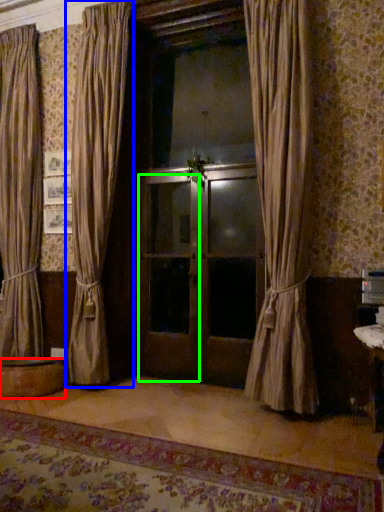
Question: Which object is positioned farthest from round table (highlighted by a red box)? Select from curtain (highlighted by a blue box) and screen door (highlighted by a green box).

Choices:
 (A) curtain
 (B) screen door

Answer: (B)